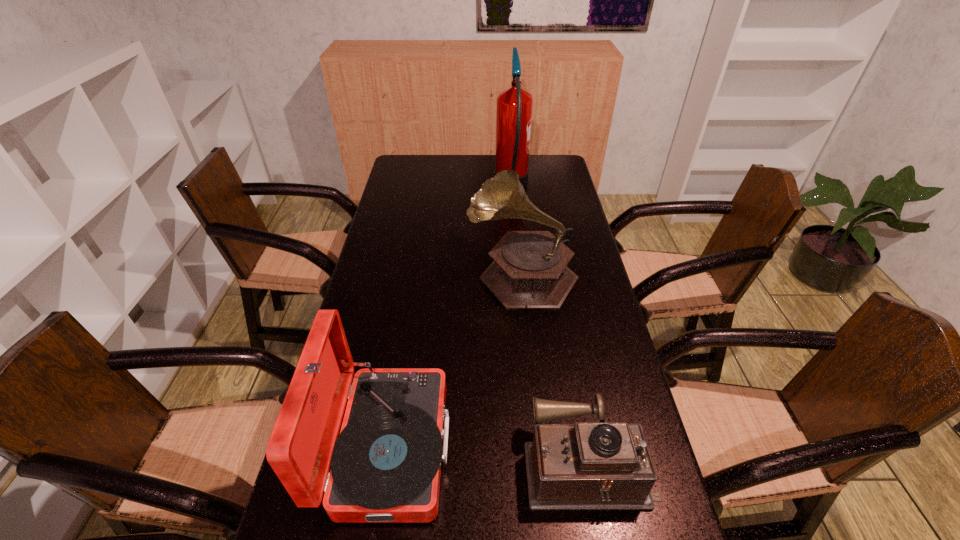
Identify the location of object identified as the second closest to the leftmost object. (529, 271).

Locate an element on the screen. The height and width of the screenshot is (540, 960). phonograph_record that is the closest to the tallest object is located at coordinates (529, 271).

Identify the location of phonograph_record that stands as the closest to the shortest object. This screenshot has height=540, width=960. (385, 464).